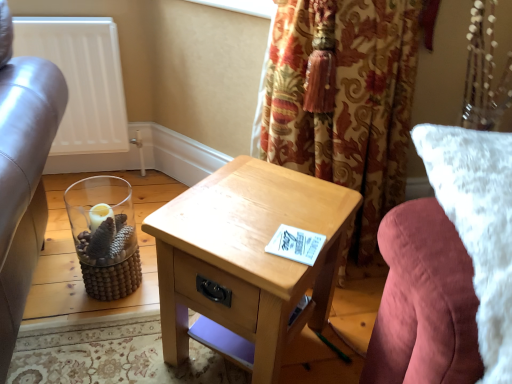
Where is `free location above white matte radiator at upper left (from a real-world perspective)`? The height and width of the screenshot is (384, 512). free location above white matte radiator at upper left (from a real-world perspective) is located at coordinates (58, 6).